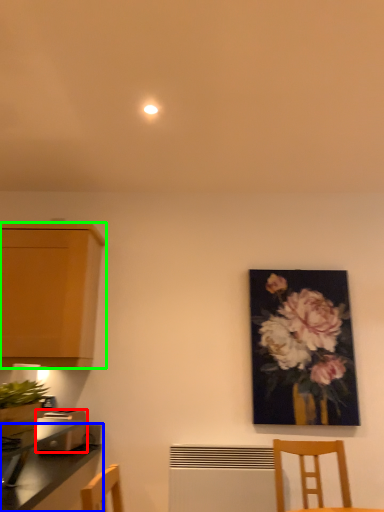
Question: Which is nearer to the toaster (highlighted by a red box)? countertop (highlighted by a blue box) or cabinetry (highlighted by a green box).

Choices:
 (A) countertop
 (B) cabinetry

Answer: (A)